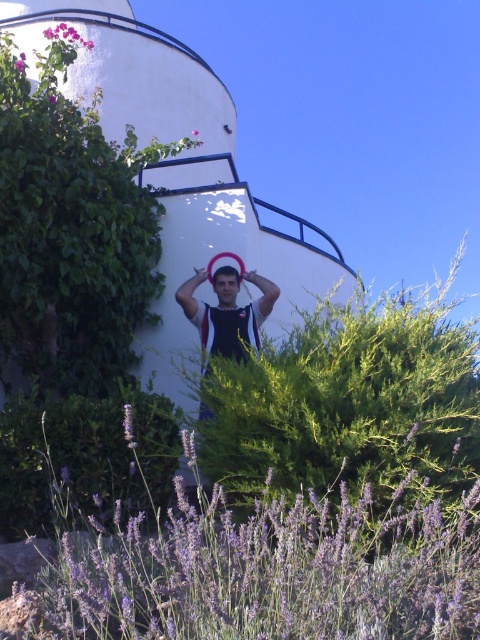
Question: Does purple soft lavender at lower center have a smaller size compared to matte black tank top at center?

Choices:
 (A) no
 (B) yes

Answer: (A)

Question: Which of these objects is positioned closest to the purple soft lavender at lower center?

Choices:
 (A) smooth skin head at center
 (B) matte black tank top at center

Answer: (B)

Question: Is purple soft lavender at lower center bigger than matte black tank top at center?

Choices:
 (A) yes
 (B) no

Answer: (A)

Question: Which of the following is the closest to the observer?

Choices:
 (A) smooth skin head at center
 (B) matte black tank top at center
 (C) purple soft lavender at lower center

Answer: (C)

Question: Can you confirm if matte black tank top at center is bigger than smooth skin head at center?

Choices:
 (A) no
 (B) yes

Answer: (B)

Question: Based on their relative distances, which object is farther from the matte black tank top at center?

Choices:
 (A) purple soft lavender at lower center
 (B) smooth skin head at center

Answer: (A)